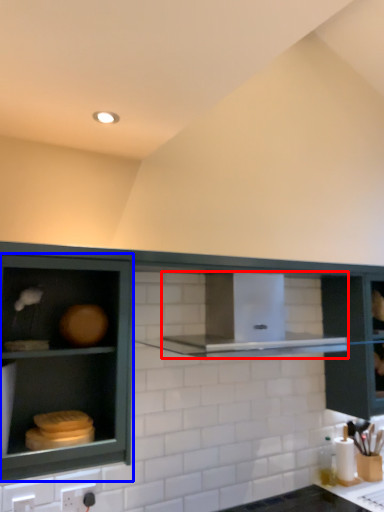
Question: Which object is closer to the camera taking this photo, vent (highlighted by a red box) or cabinetry (highlighted by a blue box)?

Choices:
 (A) vent
 (B) cabinetry

Answer: (B)